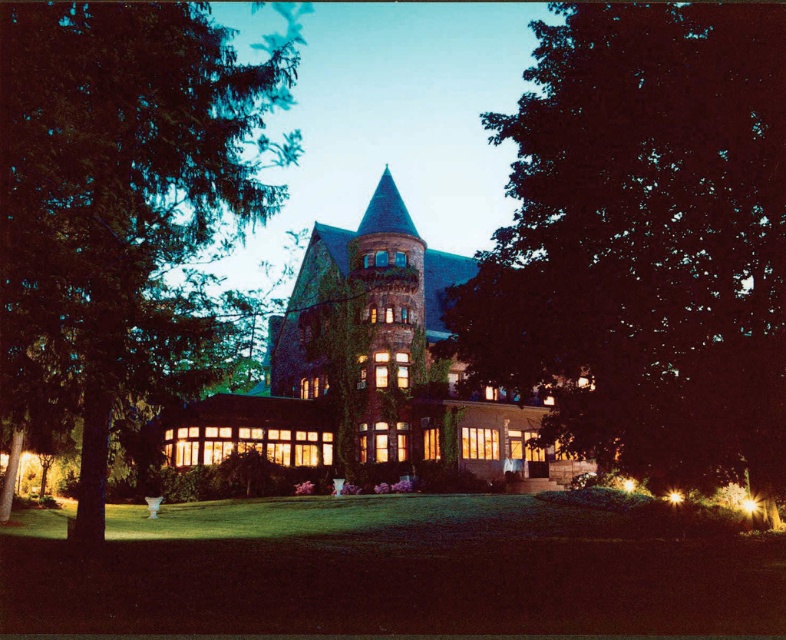
Question: Where is green leafy tree at left located in relation to green ivy-covered tower at center in the image?

Choices:
 (A) above
 (B) below

Answer: (A)

Question: Does green leafy tree at center appear on the right side of green ivy-covered tower at center?

Choices:
 (A) yes
 (B) no

Answer: (A)

Question: Considering the real-world distances, which object is closest to the green ivy-covered tower at center?

Choices:
 (A) green leafy tree at center
 (B) green leafy tree at left

Answer: (B)

Question: Which point is farther to the camera?

Choices:
 (A) (630, 442)
 (B) (333, 310)
 (C) (43, 285)

Answer: (B)

Question: Considering the real-world distances, which object is farthest from the green leafy tree at center?

Choices:
 (A) green ivy-covered tower at center
 (B) green leafy tree at left

Answer: (B)

Question: Can you confirm if green leafy tree at center is positioned to the right of green ivy-covered tower at center?

Choices:
 (A) no
 (B) yes

Answer: (B)